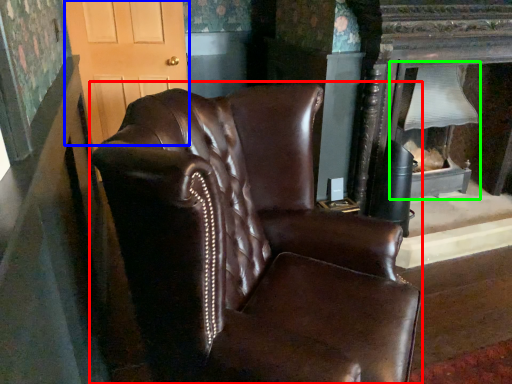
Question: Estimate the real-world distances between objects in this image. Which object is closer to chair (highlighted by a red box), glass door (highlighted by a blue box) or fireplace (highlighted by a green box)?

Choices:
 (A) glass door
 (B) fireplace

Answer: (B)